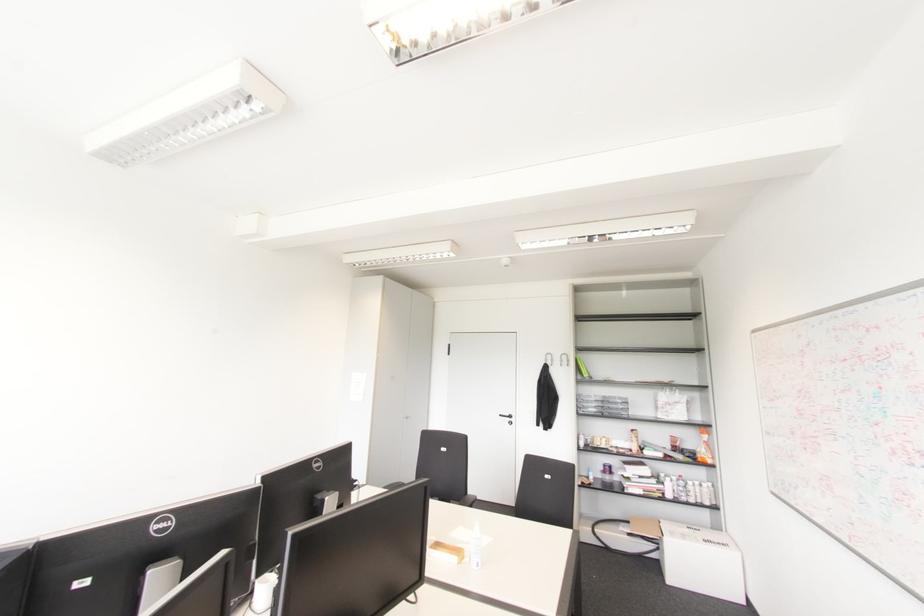
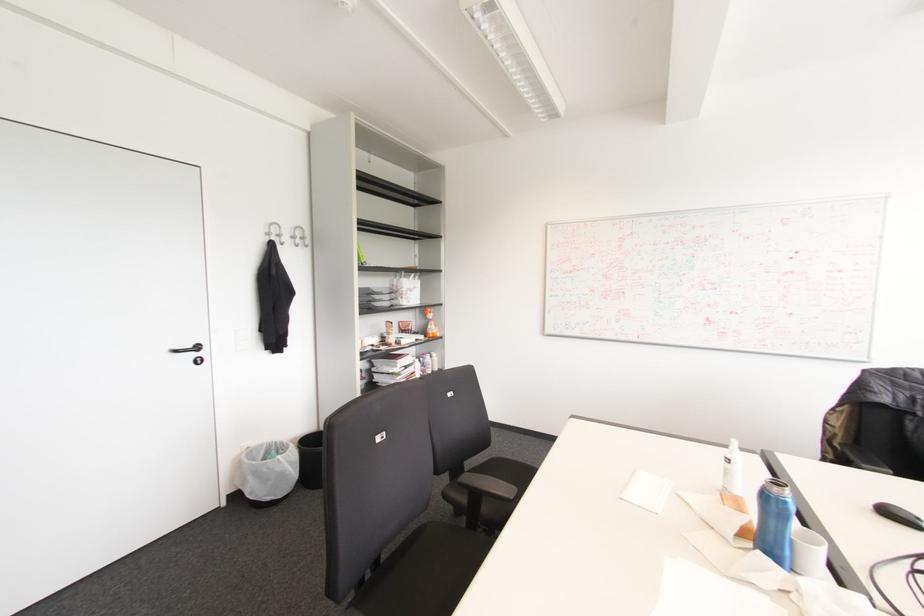
Locate, in the second image, the point that corresponds to the point at 566,360 in the first image.

(301, 238)